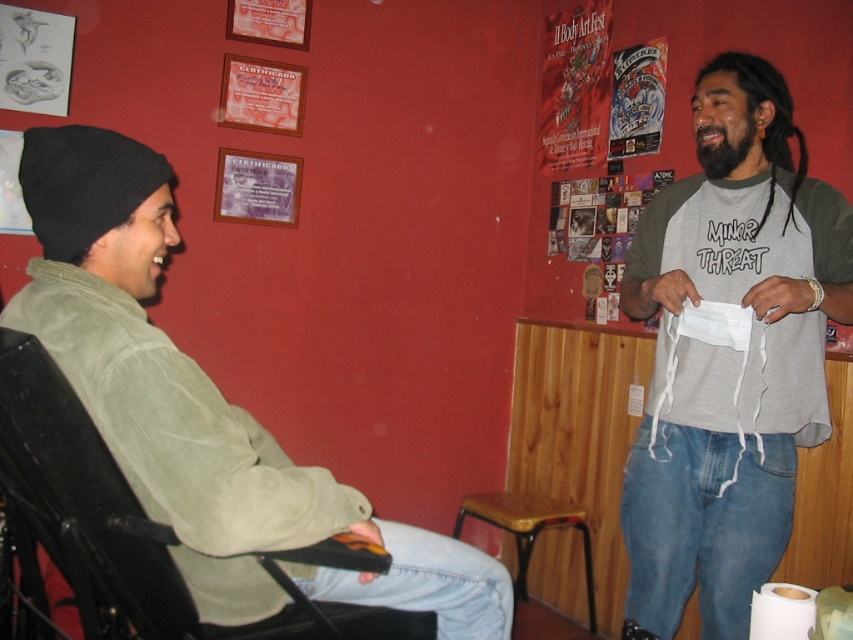
Based on the photo, what is the spatial relationship between the green corduroy jacket at left and the point labeled as point (202, 408)?

The green corduroy jacket at left is represented by the point labeled as point (202, 408).